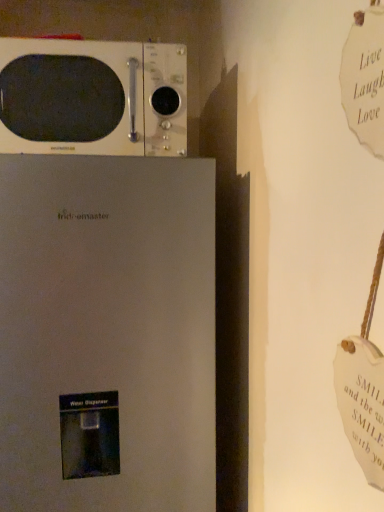
Question: Based on their sizes in the image, would you say satin white refrigerator at lower left is bigger or smaller than white glossy microwave at upper left?

Choices:
 (A) small
 (B) big

Answer: (B)

Question: Which is correct: satin white refrigerator at lower left is inside white glossy microwave at upper left, or outside of it?

Choices:
 (A) outside
 (B) inside

Answer: (A)

Question: From their relative heights in the image, would you say satin white refrigerator at lower left is taller or shorter than white glossy microwave at upper left?

Choices:
 (A) tall
 (B) short

Answer: (A)

Question: From the image's perspective, relative to satin white refrigerator at lower left, is white glossy microwave at upper left above or below?

Choices:
 (A) above
 (B) below

Answer: (A)

Question: Is white glossy microwave at upper left inside the boundaries of satin white refrigerator at lower left, or outside?

Choices:
 (A) inside
 (B) outside

Answer: (B)

Question: Relative to satin white refrigerator at lower left, is white glossy microwave at upper left in front or behind?

Choices:
 (A) front
 (B) behind

Answer: (B)

Question: From a real-world perspective, is white glossy microwave at upper left physically located above or below satin white refrigerator at lower left?

Choices:
 (A) below
 (B) above

Answer: (B)